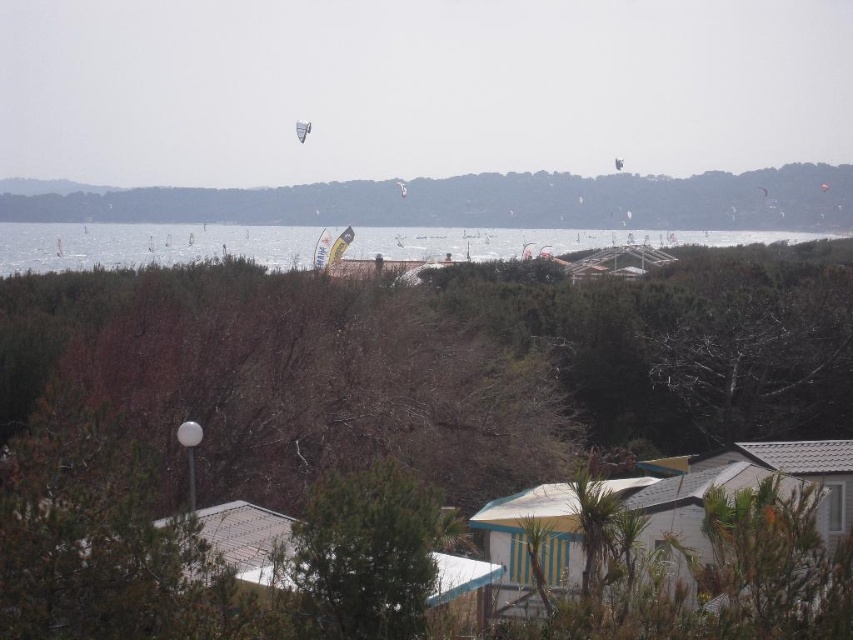
Question: Does green leafy tree at center have a larger size compared to white plastic kite at upper center?

Choices:
 (A) yes
 (B) no

Answer: (B)

Question: Among these points, which one is farthest from the camera?

Choices:
 (A) (184, 250)
 (B) (550, 186)
 (C) (173, 493)

Answer: (B)

Question: Among these points, which one is farthest from the camera?

Choices:
 (A) (665, 192)
 (B) (96, 115)

Answer: (B)

Question: Does transparent kite at upper center appear over white plastic kite at upper center?

Choices:
 (A) yes
 (B) no

Answer: (A)

Question: Does green leafy tree at center have a larger size compared to white plastic kite at upper center?

Choices:
 (A) yes
 (B) no

Answer: (B)

Question: Which of these objects is positioned closest to the white plastic kite at upper center?

Choices:
 (A) brown/drytree at center
 (B) green leafy tree at center
 (C) transparent kite at upper center

Answer: (C)